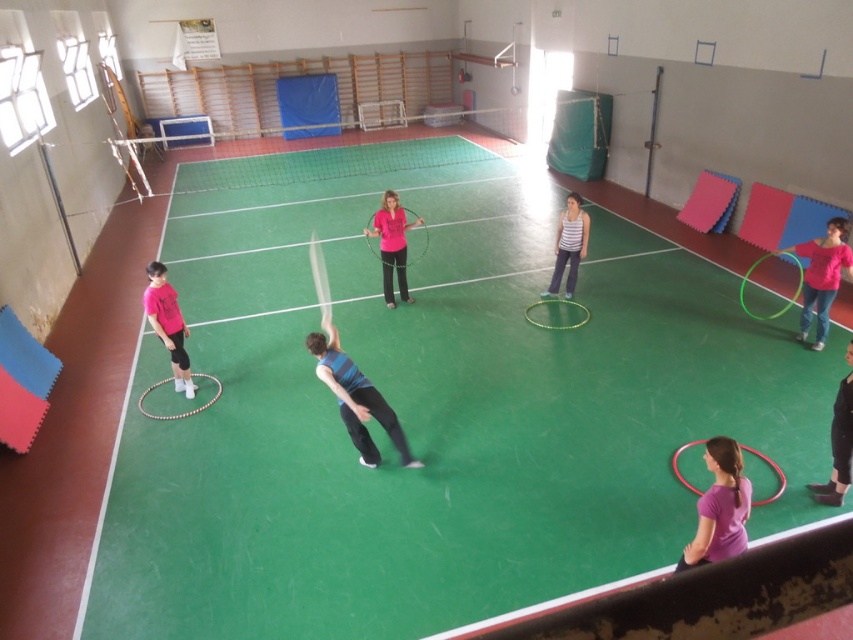
You are organizing a sports event and need to ensure participants have enough space. The blue striped shirt at center and the black matte pants at lower right are two participants. Which participant has a wider clothing width?

The blue striped shirt at center has a larger width than the black matte pants at lower right.

You are a physical education teacher planning an activity in the sports hall. You need to place a 1.2 meter tall equipment stand between the purple matte hula hoop at lower right and the striped fabric hula hoop at center. Based on their heights, will the equipment stand fit between them without being obstructed?

The purple matte hula hoop at lower right is not as tall as striped fabric hula hoop at center. Since the equipment stand is 1.2 meters tall, it might be obstructed by the taller striped fabric hula hoop at center. Therefore, the equipment stand may not fit between them without obstruction.

You are a sports equipment manager who needs to place a 3.0 meter long storage rack in the sports hall. You see the blue striped shirt at center and the black matte pants at lower right. Can you fit the storage rack horizontally between them without moving any objects?

The distance between the blue striped shirt at center and the black matte pants at lower right is 3.16 meters. Since the storage rack is 3.0 meters long, it can fit horizontally between them as there is enough space.